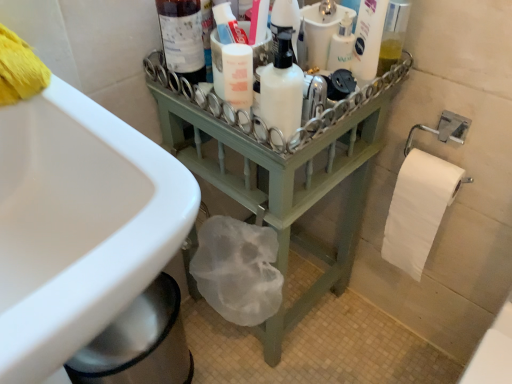
Question: From a real-world perspective, is white glossy mouthwash at center positioned above or below translucent plastic bottle at upper center, acting as the 2th cleaning product starting from the right?

Choices:
 (A) below
 (B) above

Answer: (A)

Question: From the image's perspective, relative to translucent plastic bottle at upper center, marked as the 2th cleaning product in a left-to-right arrangement, is white glossy mouthwash at center above or below?

Choices:
 (A) above
 (B) below

Answer: (B)

Question: Estimate the real-world distances between objects in this image. Which object is farther from the white glossy lotion at upper right, which is the 1th cleaning product in right-to-left order?

Choices:
 (A) translucent plastic bottle at upper center, acting as the 2th cleaning product starting from the right
 (B) white glossy sink at lower left
 (C) white glossy mouthwash at center
 (D) green painted wood at center
 (E) matte glass bottle at upper center

Answer: (B)

Question: Considering the real-world distances, which object is farthest from the matte glass bottle at upper center?

Choices:
 (A) green painted wood at center
 (B) translucent plastic bottle at upper center, acting as the 2th cleaning product starting from the right
 (C) white glossy mouthwash at center
 (D) white glossy lotion at upper right, which is the 1th cleaning product in right-to-left order
 (E) white matte bottle at center, marked as the 3th cleaning product in a right-to-left arrangement

Answer: (A)